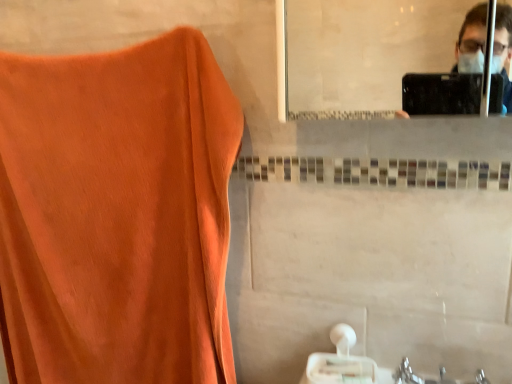
Image resolution: width=512 pixels, height=384 pixels. Find the location of `orange fabric at left`. orange fabric at left is located at coordinates (117, 214).

What do you see at coordinates (117, 214) in the screenshot? The height and width of the screenshot is (384, 512). I see `orange fabric at left` at bounding box center [117, 214].

Measure the distance between orange fabric at left and camera.

orange fabric at left and camera are 30.52 inches apart.

This screenshot has height=384, width=512. Identify the location of white matte tissue at lower center. (340, 362).

Measure the distance between white matte tissue at lower center and camera.

The distance of white matte tissue at lower center from camera is 32.90 inches.

What do you see at coordinates (340, 362) in the screenshot?
I see `white matte tissue at lower center` at bounding box center [340, 362].

The width and height of the screenshot is (512, 384). In order to click on orange fabric at left in this screenshot , I will do `click(117, 214)`.

Is white matte tissue at lower center at the left side of orange fabric at left?

No, white matte tissue at lower center is not to the left of orange fabric at left.

Who is more distant, white matte tissue at lower center or orange fabric at left?

Positioned behind is white matte tissue at lower center.

Is point (353, 329) less distant than point (162, 334)?

Yes.

From the image's perspective, is white matte tissue at lower center over orange fabric at left?

Incorrect, from the image's perspective, white matte tissue at lower center is lower than orange fabric at left.

From a real-world perspective, does white matte tissue at lower center stand above orange fabric at left?

Incorrect, from a real-world perspective, white matte tissue at lower center is lower than orange fabric at left.

Which of these two, white matte tissue at lower center or orange fabric at left, is thinner?

orange fabric at left is thinner.

Between white matte tissue at lower center and orange fabric at left, which one has more height?

Standing taller between the two is orange fabric at left.

Considering the relative sizes of white matte tissue at lower center and orange fabric at left in the image provided, is white matte tissue at lower center smaller than orange fabric at left?

Yes, white matte tissue at lower center is smaller than orange fabric at left.

Is white matte tissue at lower center spatially inside orange fabric at left, or outside of it?

white matte tissue at lower center lies outside orange fabric at left.

Is white matte tissue at lower center placed right next to orange fabric at left?

They are not placed beside each other.

Could you tell me if white matte tissue at lower center is turned towards orange fabric at left?

No, white matte tissue at lower center is not turned towards orange fabric at left.

Where is `curtain located on the left of white matte tissue at lower center`? curtain located on the left of white matte tissue at lower center is located at coordinates pos(117,214).

In the scene shown: In the image, is orange fabric at left on the left side or the right side of white matte tissue at lower center?

Clearly, orange fabric at left is on the left of white matte tissue at lower center in the image.

Which object is more forward, orange fabric at left or white matte tissue at lower center?

orange fabric at left is more forward.

Considering the points (2, 252) and (309, 367), which point is in front, point (2, 252) or point (309, 367)?

The point (309, 367) is closer.

From the image's perspective, between orange fabric at left and white matte tissue at lower center, who is located below?

white matte tissue at lower center.

From a real-world perspective, is orange fabric at left over white matte tissue at lower center?

Yes.

Is orange fabric at left wider than white matte tissue at lower center?

Incorrect, the width of orange fabric at left does not surpass that of white matte tissue at lower center.

Consider the image. Does orange fabric at left have a lesser height compared to white matte tissue at lower center?

No.

Between orange fabric at left and white matte tissue at lower center, which one has larger size?

Bigger between the two is orange fabric at left.

Is orange fabric at left surrounding white matte tissue at lower center?

Actually, white matte tissue at lower center is outside orange fabric at left.

Does orange fabric at left touch white matte tissue at lower center?

No, orange fabric at left is not in contact with white matte tissue at lower center.

Could you tell me if orange fabric at left is facing white matte tissue at lower center?

No, orange fabric at left is not aimed at white matte tissue at lower center.

What are the coordinates of `curtain on the left of white matte tissue at lower center` in the screenshot? It's located at (117, 214).

Locate an element on the screen. The height and width of the screenshot is (384, 512). curtain that appears above the white matte tissue at lower center (from a real-world perspective) is located at coordinates (117, 214).

The width and height of the screenshot is (512, 384). Identify the location of tissue that appears below the orange fabric at left (from a real-world perspective). click(340, 362).